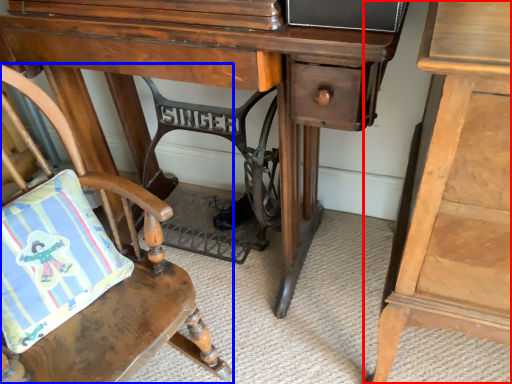
Question: Which point is closer to the camera, nightstand (highlighted by a red box) or chair (highlighted by a blue box)?

Choices:
 (A) nightstand
 (B) chair

Answer: (A)